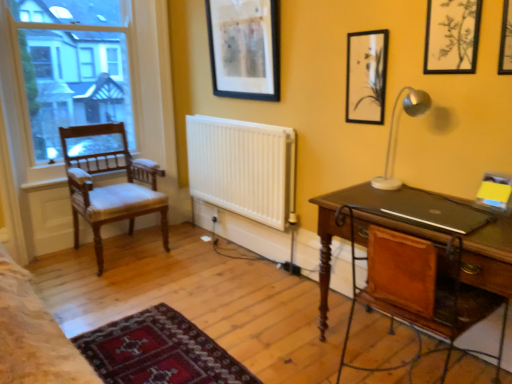
The height and width of the screenshot is (384, 512). Find the location of `blank space to the left of wooden desk at right`. blank space to the left of wooden desk at right is located at coordinates [x=278, y=332].